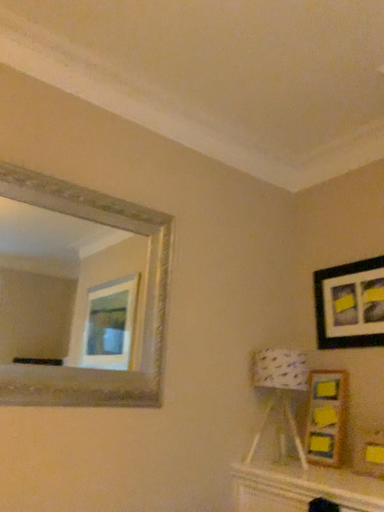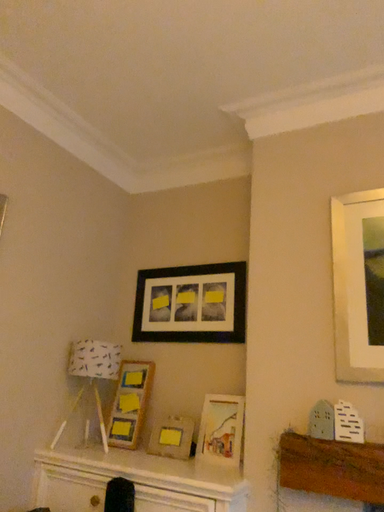
Question: How did the camera likely rotate when shooting the video?

Choices:
 (A) rotated left
 (B) rotated right

Answer: (B)